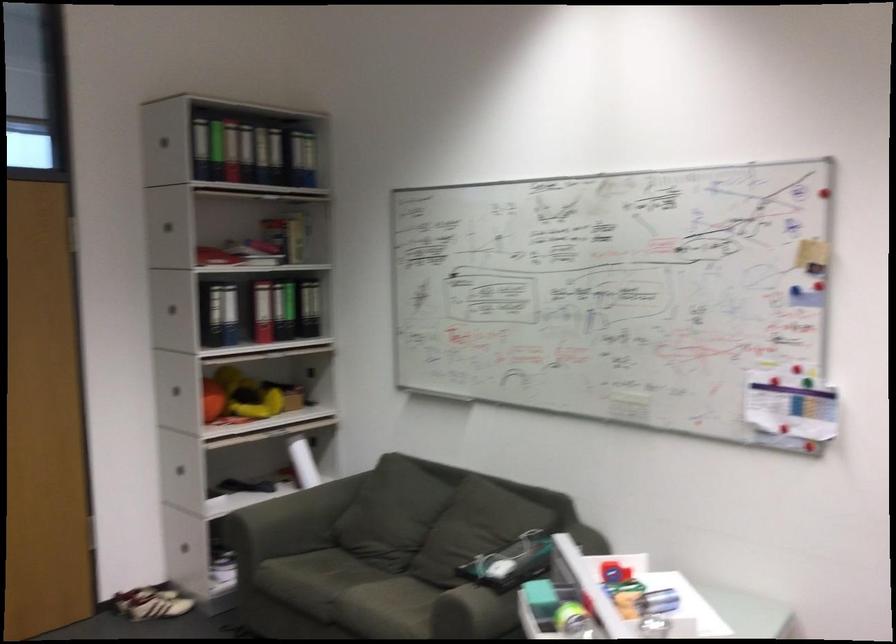
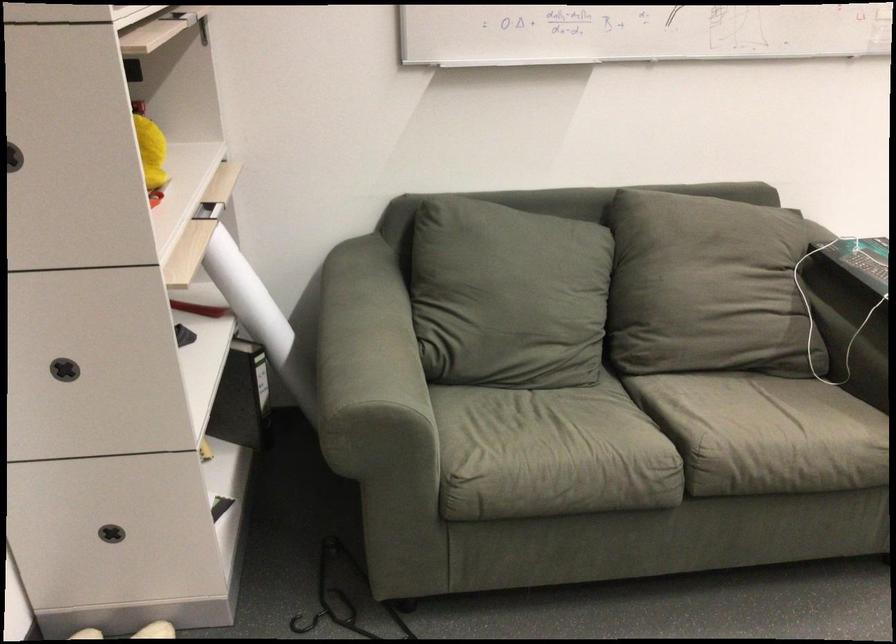
Find the pixel in the second image that matches (x=446, y=547) in the first image.

(707, 287)